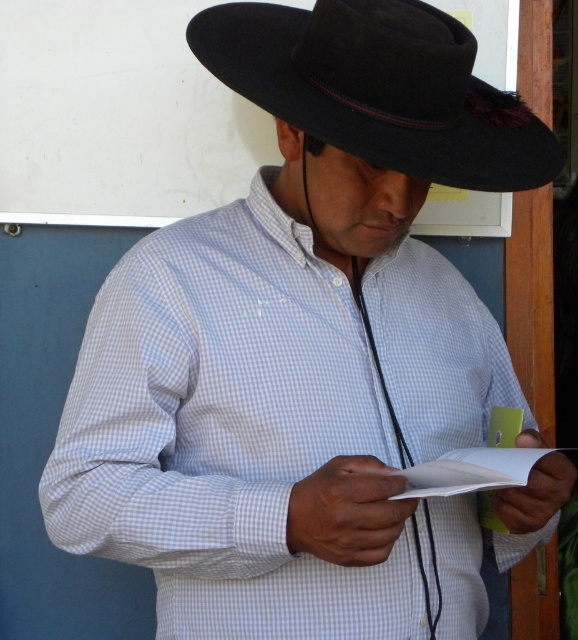
You are an artist trying to sketch the scene. You need to decide which object to draw first based on their sizes. Which one should you start with, the black felt fedora at upper center or the white paper at center?

The black felt fedora at upper center is larger in size than the white paper at center, so you should start with the black felt fedora at upper center as it occupies more space in the scene.

You are an assistant helping someone organize their desk. You see the black felt fedora at upper center and the white paper at center. Which object is positioned higher up in the image?

The black felt fedora at upper center is located above the white paper at center, so it is positioned higher up in the image.

You are a photographer trying to capture the man reading the paper. You want to place a small prop at point (379, 88) to highlight the scene. What object is already present at that location?

The black felt fedora at upper center is already located at point (379, 88), so placing another prop there might be obstructed.